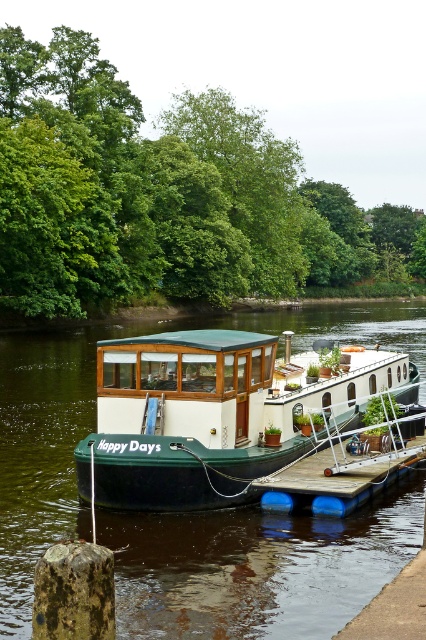
Question: Is green matte boat at center wider than green matte houseboat at center?

Choices:
 (A) yes
 (B) no

Answer: (A)

Question: Estimate the real-world distances between objects in this image. Which object is farther from the wooden at center?

Choices:
 (A) green matte boat at center
 (B) green matte houseboat at center

Answer: (A)

Question: Based on their relative distances, which object is nearer to the wooden at center?

Choices:
 (A) green matte boat at center
 (B) green matte houseboat at center

Answer: (B)

Question: Observing the image, what is the correct spatial positioning of green matte boat at center in reference to wooden at center?

Choices:
 (A) right
 (B) left

Answer: (B)

Question: Which point is closer to the camera taking this photo?

Choices:
 (A) (316, 468)
 (B) (196, 380)
 (C) (49, 541)

Answer: (C)

Question: Is green matte houseboat at center to the left of wooden at center from the viewer's perspective?

Choices:
 (A) yes
 (B) no

Answer: (A)